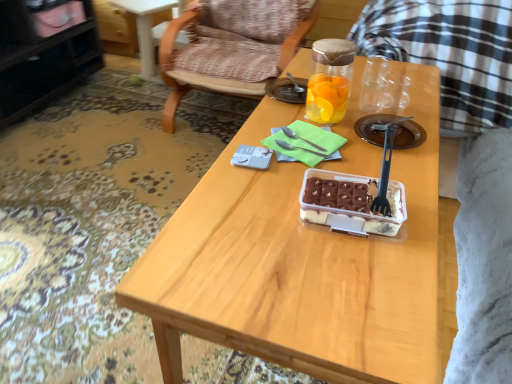
Where is `blank space to the left of translucent plastic container at center`? Image resolution: width=512 pixels, height=384 pixels. blank space to the left of translucent plastic container at center is located at coordinates (268, 215).